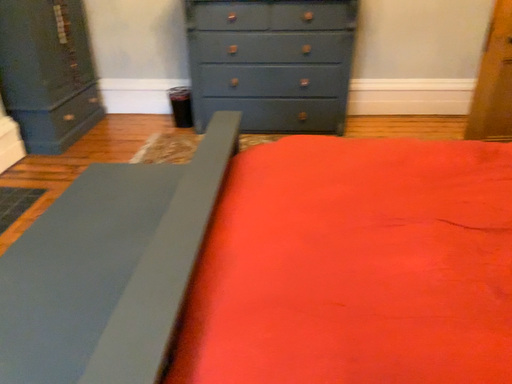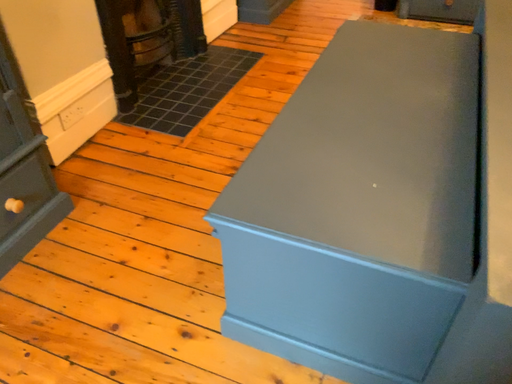
Question: Which way did the camera rotate in the video?

Choices:
 (A) rotated right
 (B) rotated left

Answer: (B)